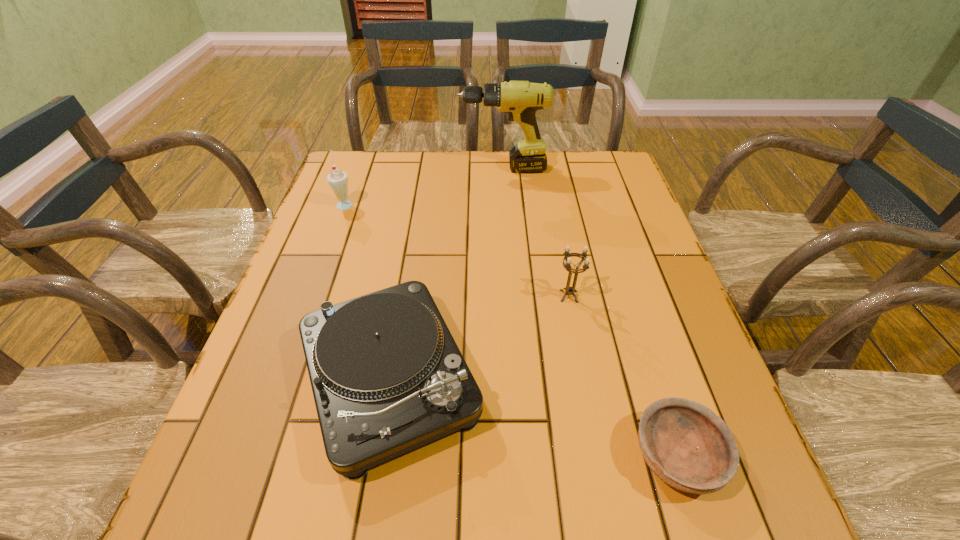
Identify the location of vacant area situated on the handle side of the farthest object. (413, 168).

At what (x,y) coordinates should I click in order to perform the action: click on vacant space located 0.170m on the straw side of the fourth nearest object. Please return your answer as a coordinate pair (x, y). The width and height of the screenshot is (960, 540). Looking at the image, I should click on (413, 204).

Locate an element on the screen. This screenshot has height=540, width=960. vacant region located 0.140m on the front of the candle holder is located at coordinates (581, 356).

The image size is (960, 540). In order to click on vacant space located 0.360m on the back of the second shortest object in this screenshot , I will do `click(419, 209)`.

This screenshot has width=960, height=540. I want to click on free space located on the back of the shortest object, so click(621, 280).

Locate an element on the screen. object situated at the far edge is located at coordinates (520, 99).

The width and height of the screenshot is (960, 540). I want to click on record player at the near edge, so click(387, 376).

Identify the location of bowl situated at the near edge. (684, 443).

Where is `milkshake located in the left edge section of the desktop`? The height and width of the screenshot is (540, 960). milkshake located in the left edge section of the desktop is located at coordinates (338, 180).

The width and height of the screenshot is (960, 540). In order to click on record player that is at the left edge in this screenshot , I will do `click(387, 376)`.